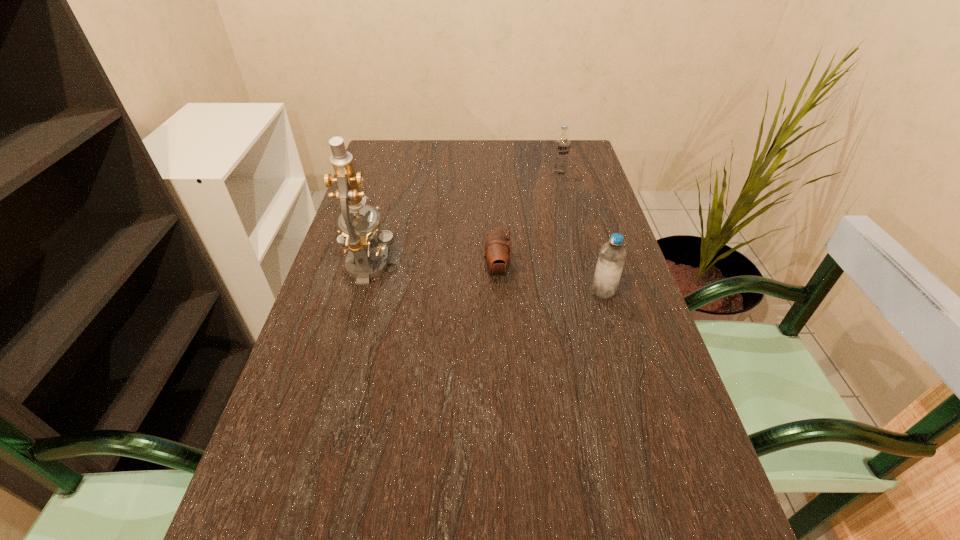
Where is `the tallest object`? Image resolution: width=960 pixels, height=540 pixels. the tallest object is located at coordinates (356, 236).

The width and height of the screenshot is (960, 540). I want to click on microscope, so click(x=356, y=236).

You are a GUI agent. You are given a task and a screenshot of the screen. Output one action in this format:
    pyautogui.click(x=<x>, y=<y>)
    Task: Click on the vodka
    
    Given the screenshot: What is the action you would take?
    pyautogui.click(x=562, y=143)

The width and height of the screenshot is (960, 540). Identify the location of water bottle. pyautogui.click(x=609, y=267).

Identify the location of pouch. Image resolution: width=960 pixels, height=540 pixels. (497, 254).

Where is `the third object from right to left`? the third object from right to left is located at coordinates (497, 254).

Identify the location of vacant space located 0.380m on the front of the microscope. (321, 444).

Locate an element on the screen. free space located 0.250m on the front label of the vodka is located at coordinates (571, 226).

At what (x,y) coordinates should I click in order to perform the action: click on free space located 0.100m on the left of the water bottle. Please return your answer as a coordinate pair (x, y). Image resolution: width=960 pixels, height=540 pixels. Looking at the image, I should click on (547, 292).

Locate an element on the screen. Image resolution: width=960 pixels, height=540 pixels. free space located with the flap open on the second object from left to right is located at coordinates (394, 271).